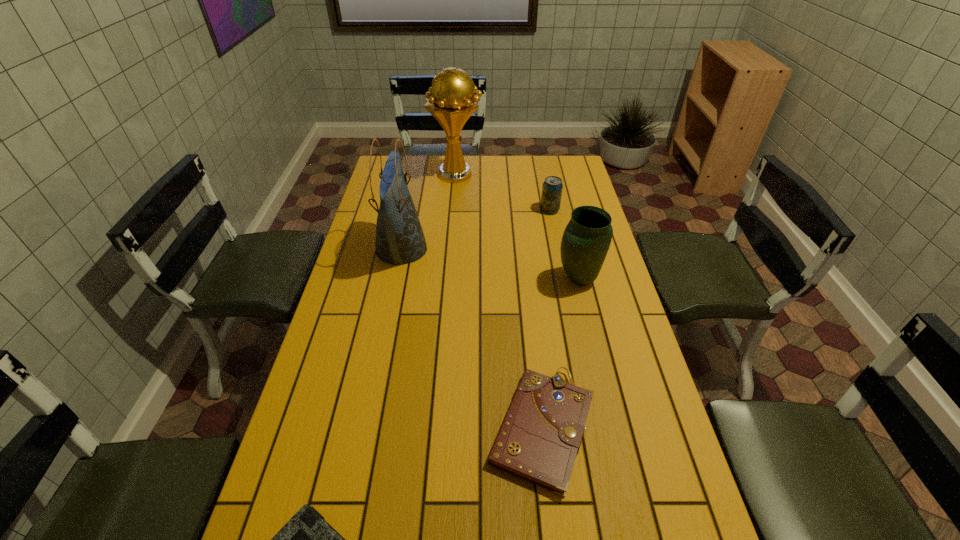
Where is `vacant region at the far right corner`? The image size is (960, 540). vacant region at the far right corner is located at coordinates (560, 177).

Locate an element on the screen. vacant area between the right notebook and the trophy_cup is located at coordinates (499, 301).

The height and width of the screenshot is (540, 960). In order to click on unoccupied position between the trophy_cup and the shopping bag in this screenshot , I will do `click(429, 212)`.

Find the location of a particular element. This screenshot has height=540, width=960. vacant space in between the pop soda and the farthest object is located at coordinates (503, 192).

Where is `vacant area that lies between the trophy_cup and the shopping bag`? vacant area that lies between the trophy_cup and the shopping bag is located at coordinates (429, 212).

Where is `vacant point located between the farther notebook and the vase`? vacant point located between the farther notebook and the vase is located at coordinates (561, 353).

Where is `free spot between the third shortest object and the shopping bag`? This screenshot has width=960, height=540. free spot between the third shortest object and the shopping bag is located at coordinates (475, 230).

You are a GUI agent. You are given a task and a screenshot of the screen. Output one action in this format:
    pyautogui.click(x=<x>, y=<y>)
    Task: Click on the object that is the closest one to the trophy_cup
    The image size is (960, 540).
    Given the screenshot: What is the action you would take?
    pyautogui.click(x=552, y=187)

Identify the location of the fifth closest object to the trophy_cup. (307, 539).

In order to click on free space that satisfies the following two spatial constraints: 1. at the front of the trophy_cup where the globe is prominent; 2. on the left side of the second farthest object in this screenshot , I will do `click(454, 210)`.